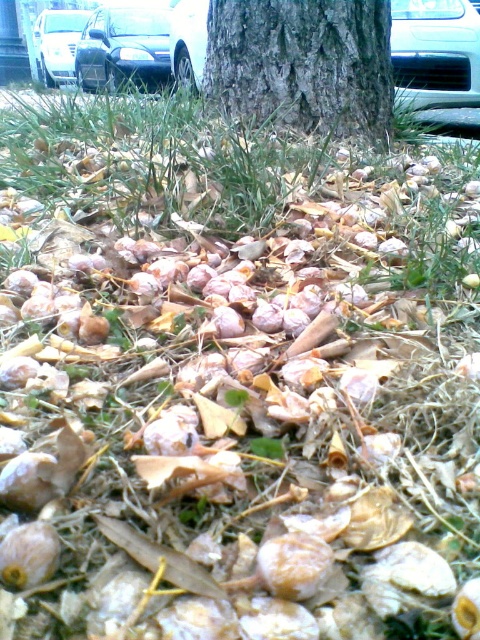
You are a gardener trying to determine which object takes up more area in the image between the brown rough tree trunk at center and the silver metallic car at upper left. Based on the scene, which one is larger?

The silver metallic car at upper left takes up more area in the image than the brown rough tree trunk at center because the brown rough tree trunk at center occupies less space than silver metallic car at upper left.

You are standing in a park near the metallic silver car at upper left and the silver metallic car at upper left. Which car is positioned to the right of the other?

The metallic silver car at upper left is to the right of the silver metallic car at upper left.

You are a photographer trying to capture the brown rough tree trunk at center and the metallic silver car at upper left in the same frame. Based on their sizes in the image, which object would appear smaller in your photo?

The brown rough tree trunk at center appears smaller in the photo because it is shorter than the metallic silver car at upper left.